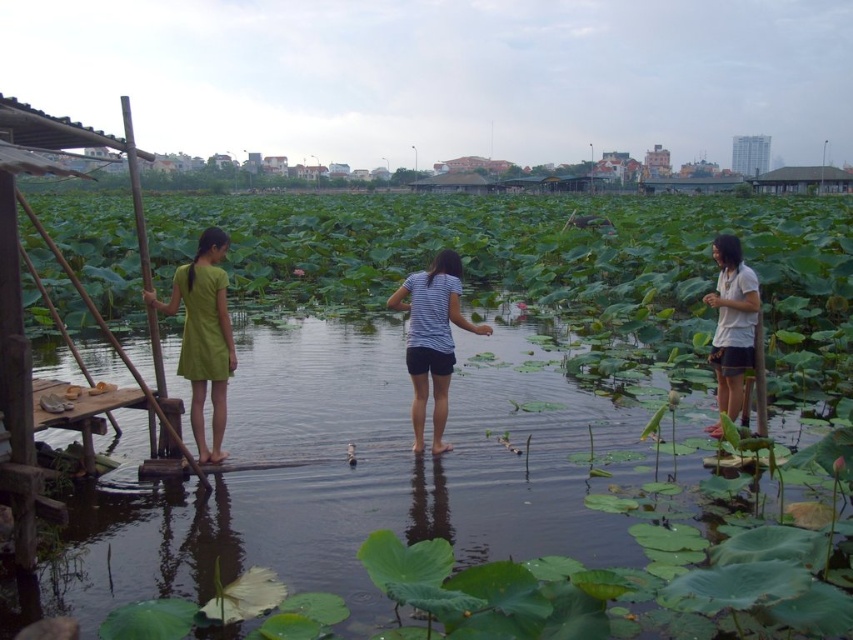
Question: Which object appears farthest from the camera in this image?

Choices:
 (A) green leafy water at center
 (B) green matte dress at left

Answer: (B)

Question: Estimate the real-world distances between objects in this image. Which object is farther from the green matte dress at left?

Choices:
 (A) striped cotton shirt at center
 (B) white cotton shirt at right
 (C) green leafy water at center

Answer: (B)

Question: Which of the following is the closest to the observer?

Choices:
 (A) pos(747,355)
 (B) pos(190,420)
 (C) pos(422,358)

Answer: (B)

Question: Observing the image, what is the correct spatial positioning of green leafy water at center in reference to green matte dress at left?

Choices:
 (A) below
 (B) above

Answer: (A)

Question: Can you confirm if green leafy water at center is positioned below white cotton shirt at right?

Choices:
 (A) yes
 (B) no

Answer: (A)

Question: Is green matte dress at left wider than white cotton shirt at right?

Choices:
 (A) no
 (B) yes

Answer: (B)